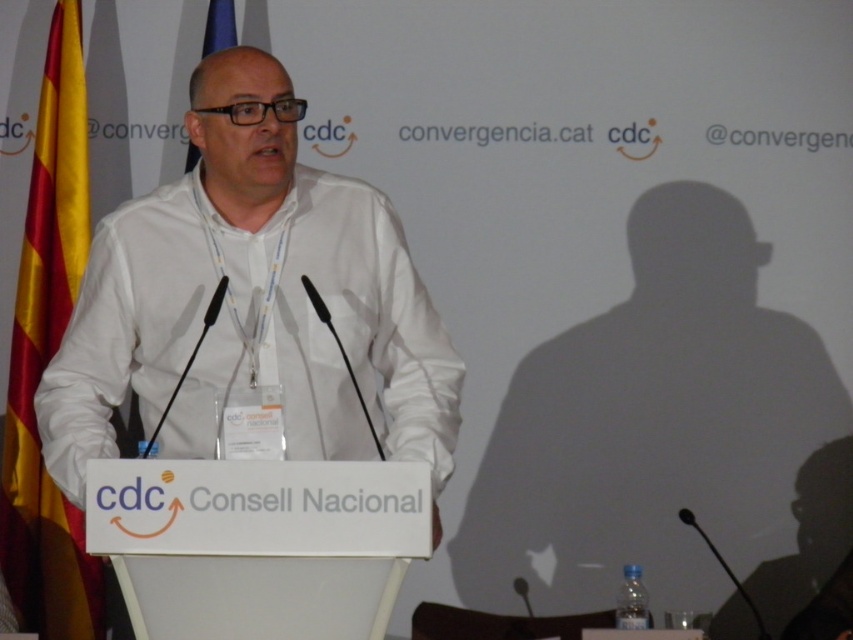
Can you confirm if white matte shirt at center is shorter than yellow/red striped fabric at left?

Correct, white matte shirt at center is not as tall as yellow/red striped fabric at left.

Between white matte shirt at center and yellow/red striped fabric at left, which one appears on the left side from the viewer's perspective?

Positioned to the left is yellow/red striped fabric at left.

Locate an element on the screen. This screenshot has height=640, width=853. white matte shirt at center is located at coordinates (252, 300).

This screenshot has width=853, height=640. I want to click on white matte shirt at center, so click(252, 300).